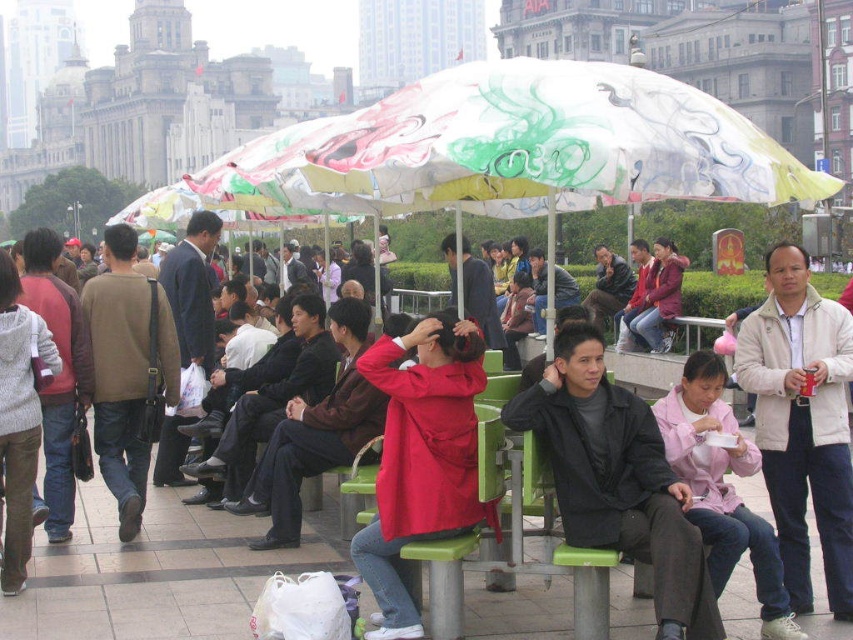
Question: Which point is farther from the camera taking this photo?

Choices:
 (A) (445, 524)
 (B) (9, 525)

Answer: (B)

Question: Considering the relative positions of light beige jacket at center and pink fabric jacket at lower right in the image provided, where is light beige jacket at center located with respect to pink fabric jacket at lower right?

Choices:
 (A) right
 (B) left

Answer: (A)

Question: Does light beige jacket at center come behind pink fabric jacket at lower right?

Choices:
 (A) no
 (B) yes

Answer: (B)

Question: Estimate the real-world distances between objects in this image. Which object is closer to the matte black jacket at center?

Choices:
 (A) brown leather jacket at left
 (B) knitted gray sweater at left
 (C) white fabric umbrella at center
 (D) pink fabric jacket at lower right

Answer: (D)

Question: Is matte black jacket at center thinner than pink fabric jacket at lower right?

Choices:
 (A) yes
 (B) no

Answer: (B)

Question: Which object is closer to the camera taking this photo?

Choices:
 (A) knitted gray sweater at left
 (B) brown leather jacket at left
 (C) matte red jacket at center

Answer: (C)